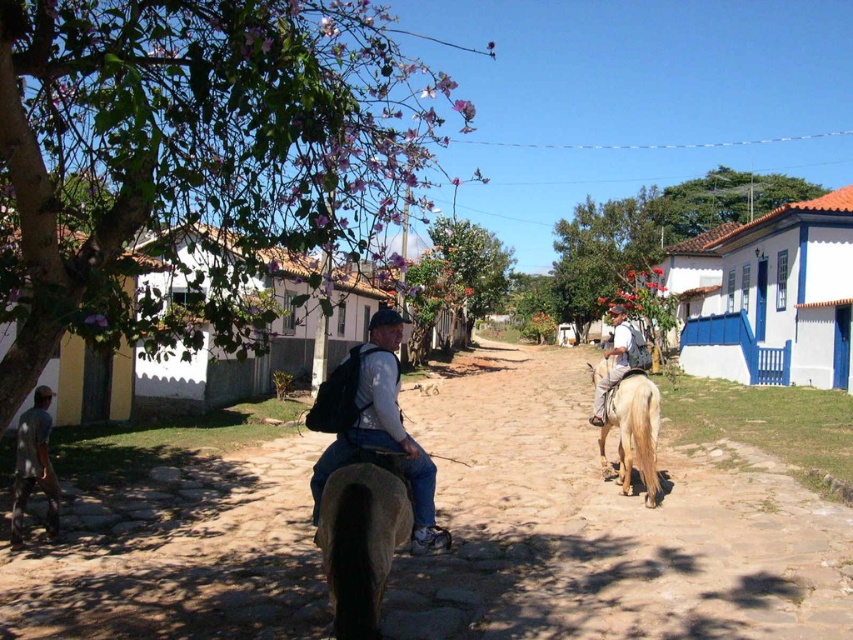
You are standing at the point marked by the coordinate point at (633, 433). What object are you standing on?

The point at (633, 433) is on the golden blonde horse at right.

In the scene shown: You are a tourist visiting this village and want to take a photo of both the brown matte horse at center and the golden blonde horse at right. Since you have a camera with a limited zoom, you need to know which horse is taller to ensure proper framing. Can you tell me which one is taller?

→ The brown matte horse at center is taller than the golden blonde horse at right, so you should frame the photo to accommodate its greater height.